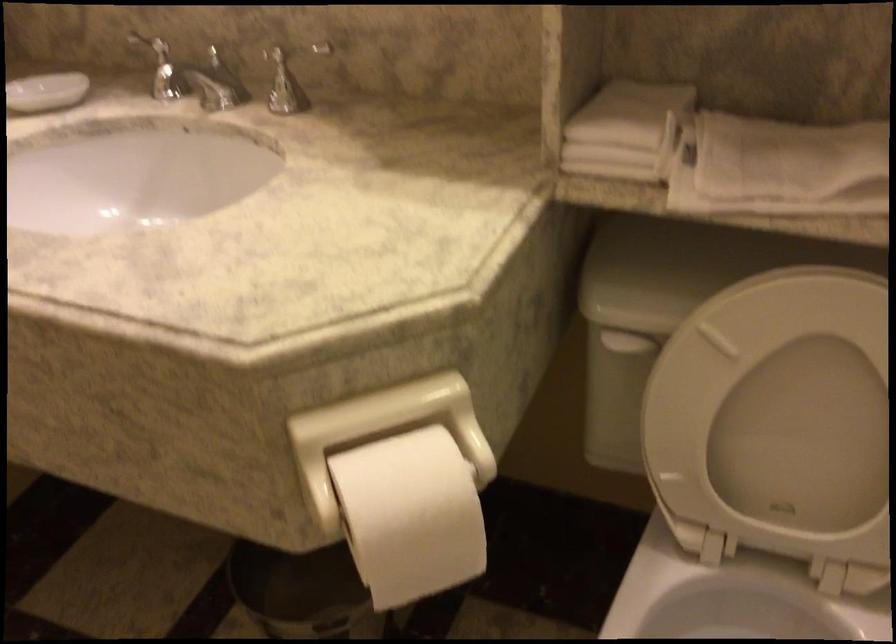
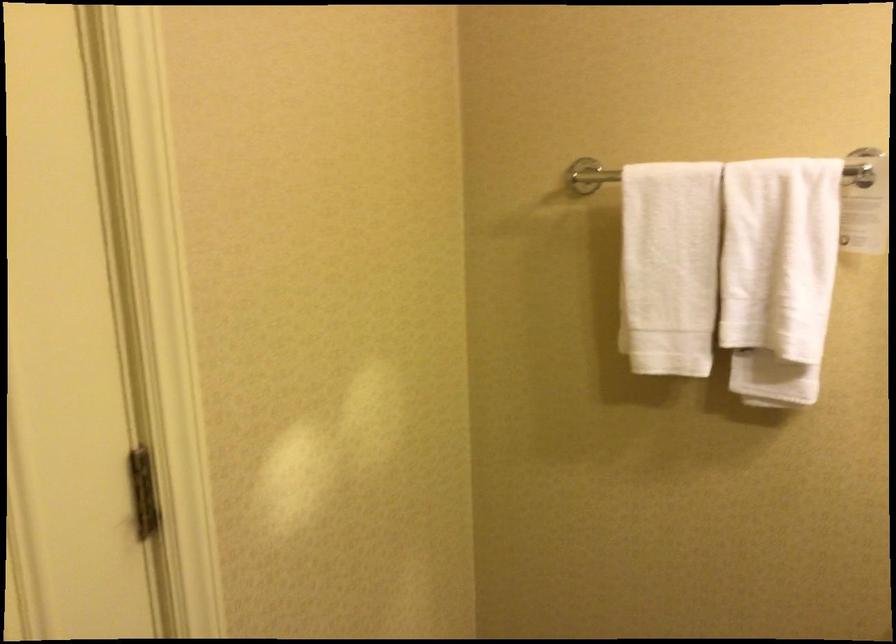
The first image is from the beginning of the video and the second image is from the end. How did the camera likely rotate when shooting the video?

The camera's rotation is toward left-down.